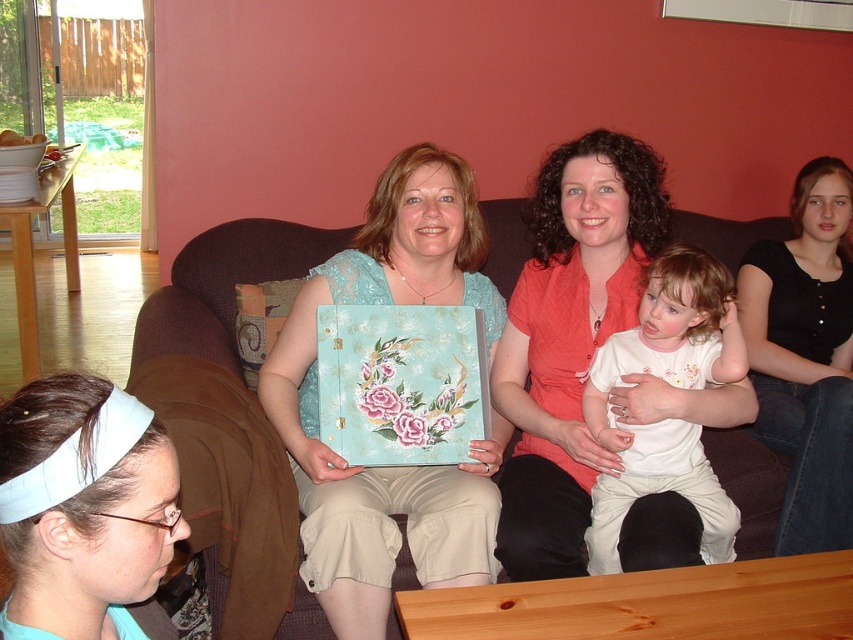
Question: Among these objects, which one is nearest to the camera?

Choices:
 (A) black matte shirt at upper right
 (B) white cotton shirt at center
 (C) brown fabric couch at center
 (D) matte coral blouse at center

Answer: (D)

Question: Can you confirm if matte teal fabric album at center is positioned to the right of matte coral blouse at center?

Choices:
 (A) yes
 (B) no

Answer: (B)

Question: Can you confirm if black matte shirt at upper right is wider than white fabric headband at lower left?

Choices:
 (A) no
 (B) yes

Answer: (B)

Question: Is matte coral blouse at center positioned before black matte shirt at upper right?

Choices:
 (A) yes
 (B) no

Answer: (A)

Question: Among these objects, which one is nearest to the camera?

Choices:
 (A) brown fabric couch at center
 (B) matte coral blouse at center
 (C) white cotton shirt at center

Answer: (B)

Question: Which of these objects is positioned closest to the brown fabric couch at center?

Choices:
 (A) matte coral blouse at center
 (B) matte teal fabric album at center

Answer: (B)